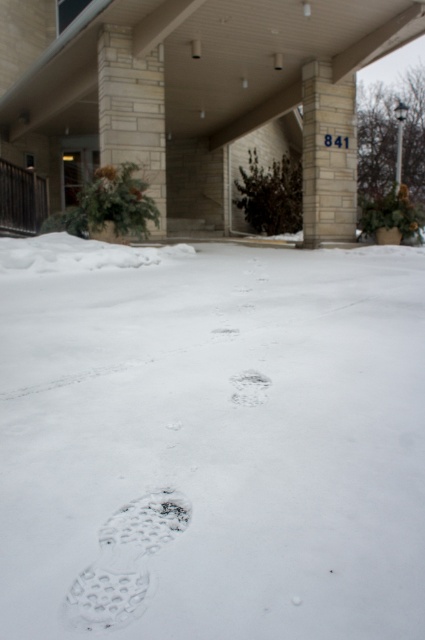
You are standing at the entrance of the building and want to determine which of the two points, point (x=399, y=531) or point (x=170, y=522), is closer to you. Based on the scene description, which point is nearer?

Point (x=399, y=531) is closer to the viewer than point (x=170, y=522).